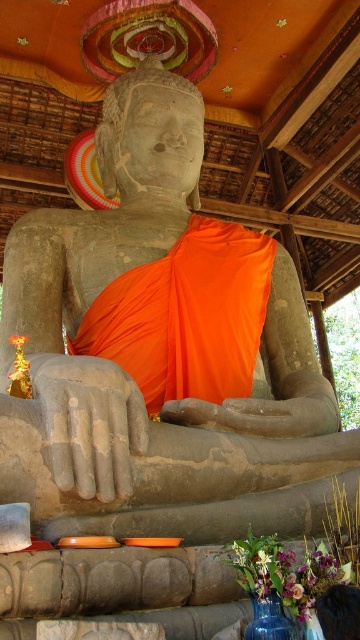
Question: Does orange silk robe at center appear over smooth dark wood frame at lower right?

Choices:
 (A) yes
 (B) no

Answer: (A)

Question: Which of the following is the farthest from the observer?

Choices:
 (A) (200, 348)
 (B) (330, 588)

Answer: (A)

Question: Is orange silk robe at center smaller than smooth dark wood frame at lower right?

Choices:
 (A) no
 (B) yes

Answer: (A)

Question: Which object is farther from the camera taking this photo?

Choices:
 (A) smooth dark wood frame at lower right
 (B) orange silk robe at center

Answer: (B)

Question: From the image, what is the correct spatial relationship of orange silk robe at center in relation to smooth dark wood frame at lower right?

Choices:
 (A) right
 (B) left

Answer: (B)